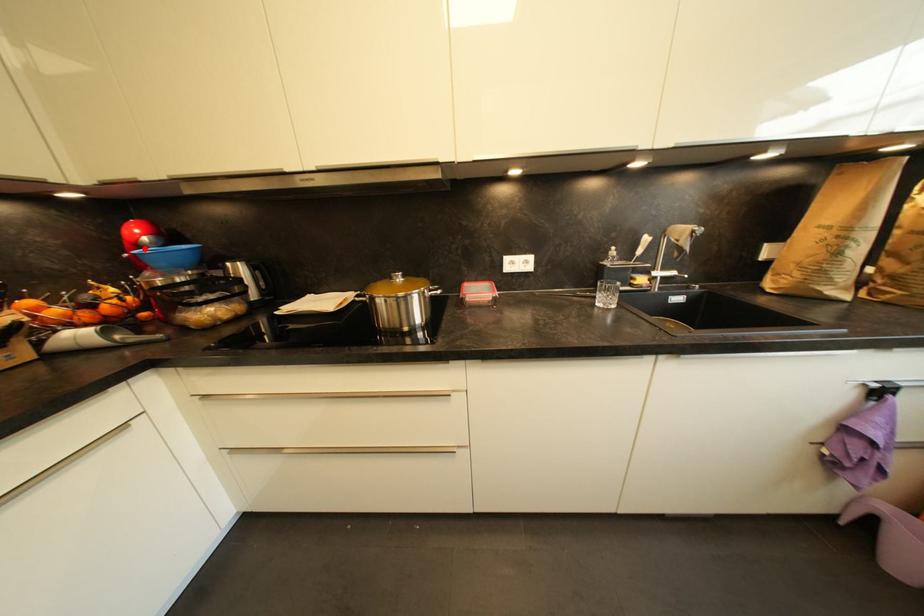
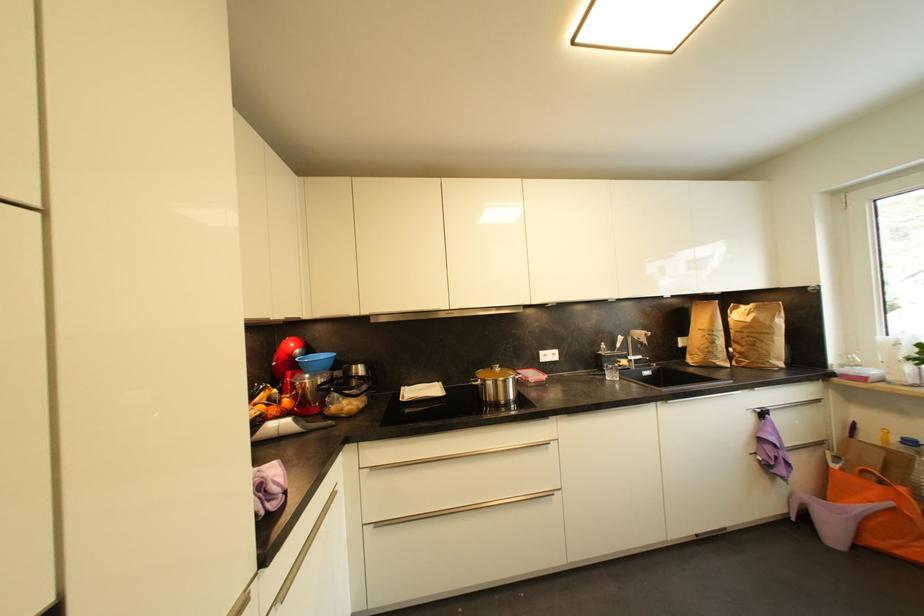
Find the pixel in the second image that matches the highlighted location in the first image.

(297, 359)